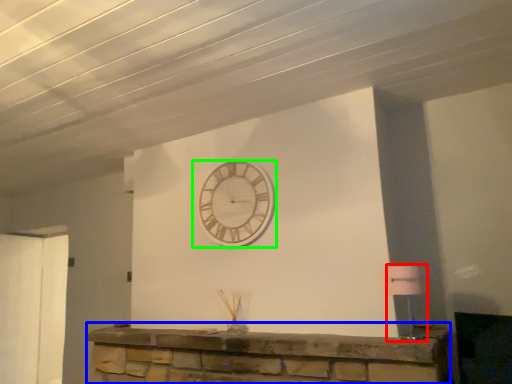
Question: Considering the real-world distances, which object is closest to lamp (highlighted by a red box)? furniture (highlighted by a blue box) or wall clock (highlighted by a green box).

Choices:
 (A) furniture
 (B) wall clock

Answer: (A)